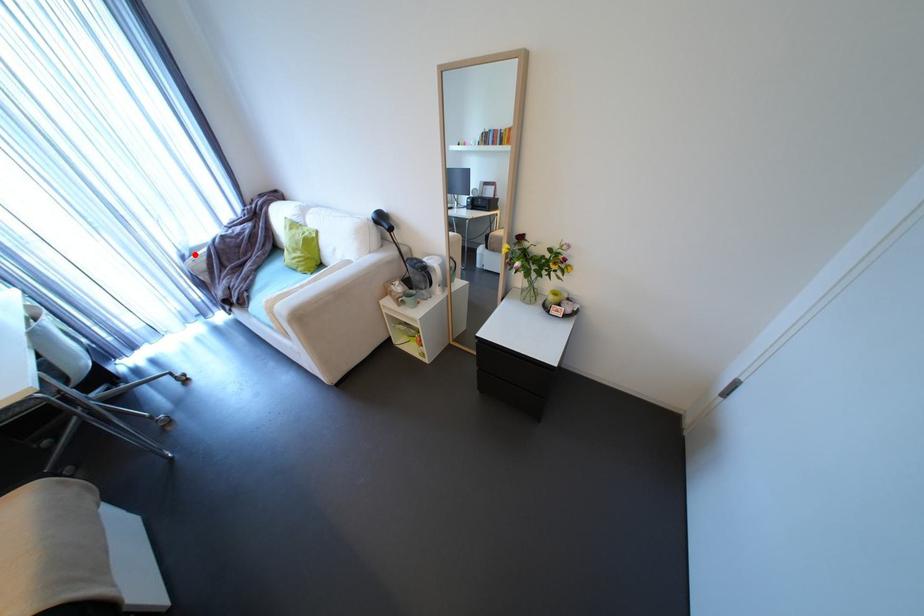
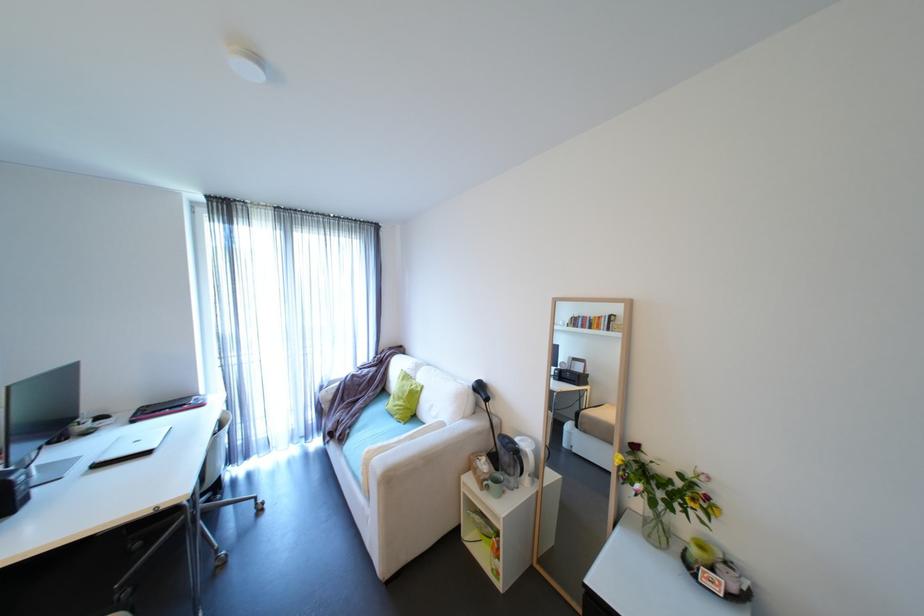
Question: I am providing you with two images of the same scene from different viewpoints. Given a red point in image1, look at the same physical point in image2. Is it:

Choices:
 (A) Closer to the viewpoint
 (B) Farther from the viewpoint

Answer: (B)